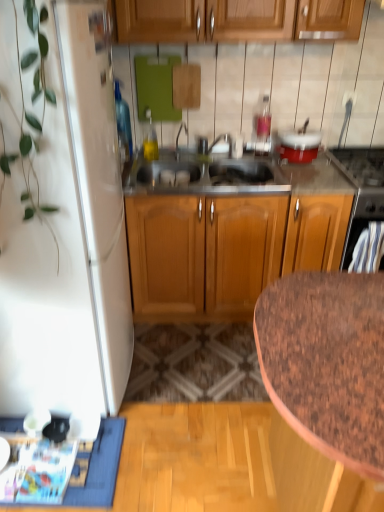
Question: Is brown speckled granite at lower right taller than black glass stove at upper right, positioned as the 2th appliance in left-to-right order?

Choices:
 (A) no
 (B) yes

Answer: (B)

Question: From the image's perspective, is brown speckled granite at lower right below black glass stove at upper right, positioned as the 2th appliance in left-to-right order?

Choices:
 (A) yes
 (B) no

Answer: (A)

Question: Is brown speckled granite at lower right closer to the viewer compared to black glass stove at upper right, positioned as the 2th appliance in left-to-right order?

Choices:
 (A) yes
 (B) no

Answer: (A)

Question: Can you confirm if brown speckled granite at lower right is thinner than black glass stove at upper right, positioned as the 2th appliance in left-to-right order?

Choices:
 (A) no
 (B) yes

Answer: (A)

Question: Is the position of brown speckled granite at lower right more distant than that of black glass stove at upper right, positioned as the 2th appliance in left-to-right order?

Choices:
 (A) no
 (B) yes

Answer: (A)

Question: From a real-world perspective, relative to blue fabric doormat at lower left, is white matte refrigerator at left vertically above or below?

Choices:
 (A) below
 (B) above

Answer: (B)

Question: In terms of width, does white matte refrigerator at left look wider or thinner when compared to blue fabric doormat at lower left?

Choices:
 (A) thin
 (B) wide

Answer: (B)

Question: Is point (115, 133) closer or farther from the camera than point (87, 487)?

Choices:
 (A) closer
 (B) farther

Answer: (B)

Question: Is white matte refrigerator at left spatially inside blue fabric doormat at lower left, or outside of it?

Choices:
 (A) inside
 (B) outside

Answer: (B)

Question: Is point (11, 348) closer or farther from the camera than point (314, 345)?

Choices:
 (A) farther
 (B) closer

Answer: (A)

Question: Considering the positions of white matte refrigerator at left and brown speckled granite at lower right in the image, is white matte refrigerator at left taller or shorter than brown speckled granite at lower right?

Choices:
 (A) short
 (B) tall

Answer: (B)

Question: From a real-world perspective, relative to brown speckled granite at lower right, is white matte refrigerator at left vertically above or below?

Choices:
 (A) below
 (B) above

Answer: (B)

Question: Is white matte refrigerator at left spatially inside brown speckled granite at lower right, or outside of it?

Choices:
 (A) outside
 (B) inside

Answer: (A)

Question: Considering the positions of blue fabric doormat at lower left and black glass stove at upper right, positioned as the 2th appliance in left-to-right order, in the image, is blue fabric doormat at lower left taller or shorter than black glass stove at upper right, positioned as the 2th appliance in left-to-right order,?

Choices:
 (A) short
 (B) tall

Answer: (A)

Question: Does point (87, 497) appear closer or farther from the camera than point (377, 189)?

Choices:
 (A) closer
 (B) farther

Answer: (A)